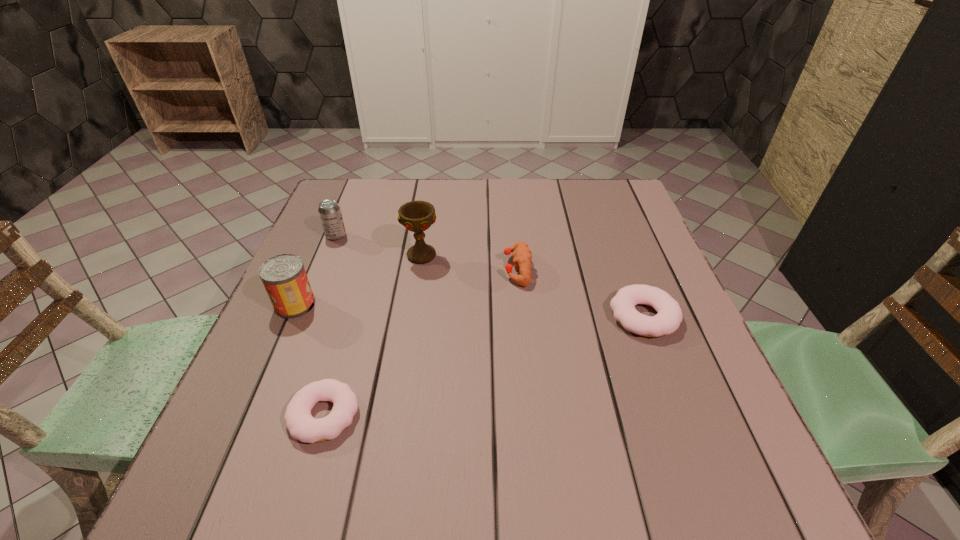
This screenshot has width=960, height=540. Identify the location of vacant region that satisfies the following two spatial constraints: 1. on the front side of the beer can; 2. on the right side of the chalice. (328, 255).

Find the location of a particular element. The width and height of the screenshot is (960, 540). vacant space that satisfies the following two spatial constraints: 1. on the front side of the chalice; 2. on the right side of the farthest object is located at coordinates (328, 255).